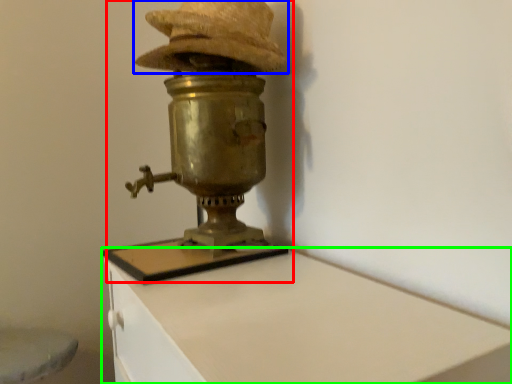
Question: Which is nearer to the table lamp (highlighted by a red box)? hat (highlighted by a blue box) or furniture (highlighted by a green box).

Choices:
 (A) hat
 (B) furniture

Answer: (A)